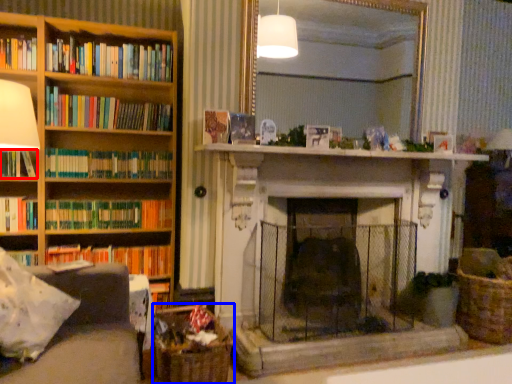
Question: Which object appears closest to the camera in this image, book (highlighted by a red box) or basket (highlighted by a blue box)?

Choices:
 (A) book
 (B) basket

Answer: (B)